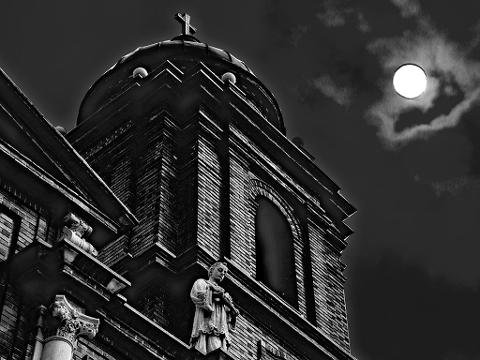
You are a GUI agent. You are given a task and a screenshot of the screen. Output one action in this format:
    pyautogui.click(x=<x>, y=<y>)
    Task: Click on the window
    The width and height of the screenshot is (480, 360).
    Given the screenshot: What is the action you would take?
    pyautogui.click(x=289, y=248)